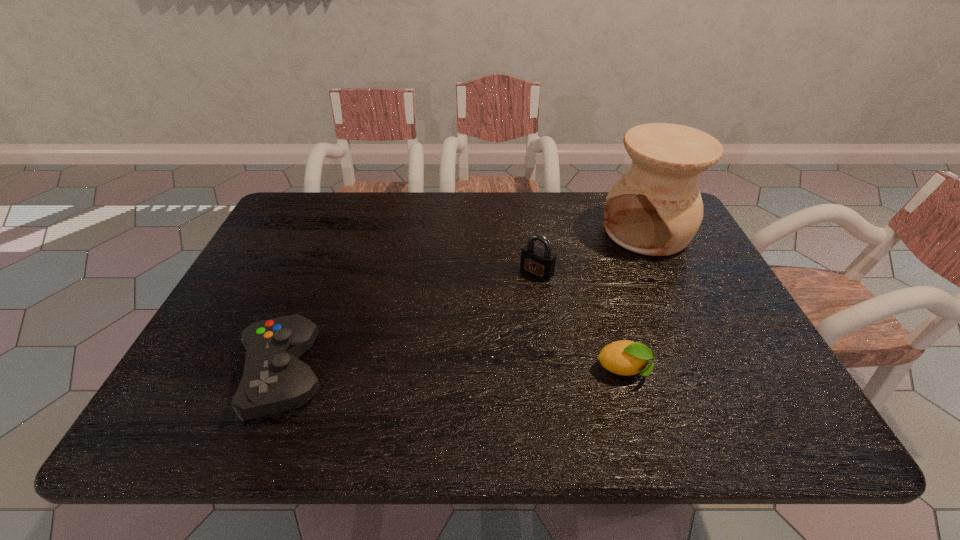
I want to click on control, so click(274, 380).

Image resolution: width=960 pixels, height=540 pixels. I want to click on lemon, so click(x=624, y=357).

Locate an element on the screen. Image resolution: width=960 pixels, height=540 pixels. the third shortest object is located at coordinates (536, 261).

This screenshot has height=540, width=960. In order to click on the third object from right to left in this screenshot , I will do `click(536, 261)`.

Locate an element on the screen. pottery is located at coordinates (655, 208).

The width and height of the screenshot is (960, 540). I want to click on the farthest object, so click(655, 208).

Find the location of a particular element. Image resolution: width=960 pixels, height=540 pixels. vacant region located on the back of the leftmost object is located at coordinates (322, 279).

I want to click on free space located 0.120m with leaves positioned above the lemon, so click(x=709, y=371).

Identify the location of vacant space located on the front of the third shortest object near the keyhole. The height and width of the screenshot is (540, 960). (476, 339).

Where is `free space located 0.210m on the front of the third shortest object near the keyhole`? free space located 0.210m on the front of the third shortest object near the keyhole is located at coordinates (484, 330).